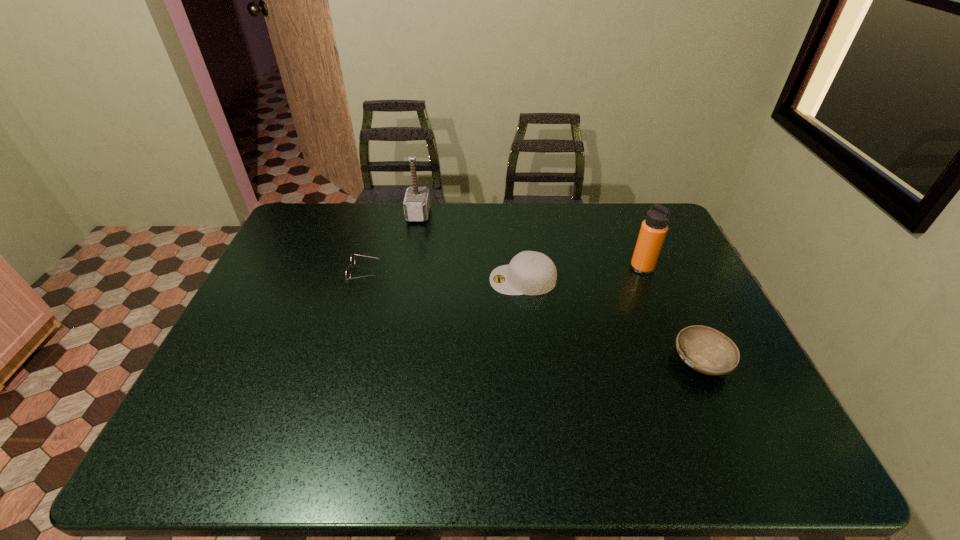
Locate an element on the screen. Image resolution: width=960 pixels, height=540 pixels. vacant point at the near edge is located at coordinates (356, 444).

This screenshot has height=540, width=960. What are the coordinates of `free space at the left edge of the desktop` in the screenshot? It's located at (307, 262).

Locate an element on the screen. free space at the right edge of the desktop is located at coordinates (704, 318).

In the image, there is a desktop. Where is `blank space at the far left corner`? This screenshot has height=540, width=960. blank space at the far left corner is located at coordinates (300, 241).

In the image, there is a desktop. Where is `free region at the near left corner`? free region at the near left corner is located at coordinates (244, 437).

Locate an element on the screen. vacant area that lies between the fourth object from right to left and the shortest object is located at coordinates (392, 244).

Locate an element on the screen. free space between the thermos bottle and the third object from right to left is located at coordinates (583, 274).

Locate an element on the screen. This screenshot has width=960, height=540. free space that is in between the farthest object and the third object from right to left is located at coordinates (470, 247).

This screenshot has height=540, width=960. Identify the location of free point between the second object from left to right and the thermos bottle. (530, 241).

Identify the location of free point between the thermos bottle and the farthest object. This screenshot has width=960, height=540. (530, 241).